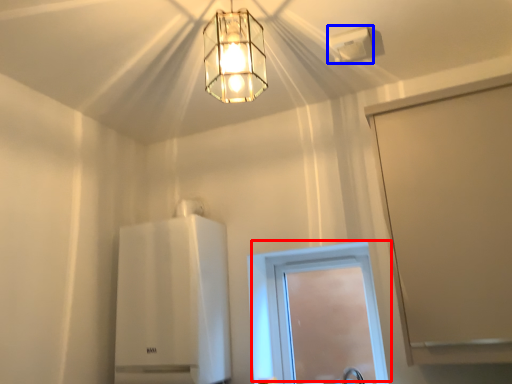
Question: Which of the following is the farthest to the observer, window (highlighted by a red box) or lamp (highlighted by a blue box)?

Choices:
 (A) window
 (B) lamp

Answer: (A)